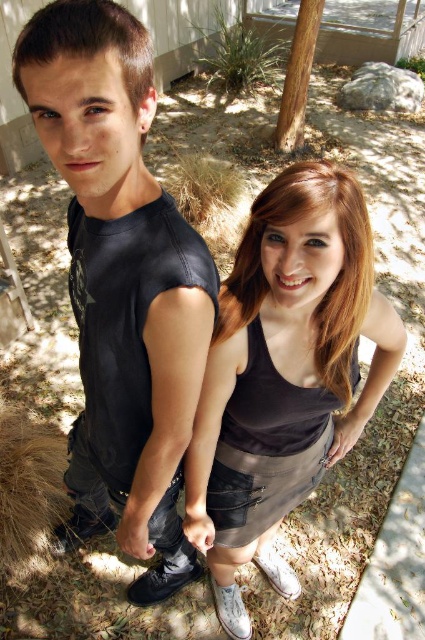
Identify the location of matte black t-shirt at center. (121, 282).

From the picture: Is matte black t-shirt at center positioned before brown rough bark at upper center?

That is True.

Describe the element at coordinates (121, 282) in the screenshot. I see `matte black t-shirt at center` at that location.

Locate an element on the screen. This screenshot has width=425, height=640. matte black t-shirt at center is located at coordinates (121, 282).

Which is more to the right, matte black tank top at center or brown rough bark at upper center?

brown rough bark at upper center

Is point (232, 609) positioned behind point (303, 20)?

No, it is not.

Find the location of a particular element. The image size is (425, 640). matte black tank top at center is located at coordinates (285, 372).

Does matte black t-shirt at center appear on the left side of matte black tank top at center?

Indeed, matte black t-shirt at center is positioned on the left side of matte black tank top at center.

Does matte black t-shirt at center have a greater height compared to matte black tank top at center?

Indeed, matte black t-shirt at center has a greater height compared to matte black tank top at center.

Does point (146, 396) come in front of point (312, 355)?

Yes, point (146, 396) is in front of point (312, 355).

You are a GUI agent. You are given a task and a screenshot of the screen. Output one action in this format:
    pyautogui.click(x=<x>, y=<y>)
    Task: Click on the matte black t-shirt at center
    
    Given the screenshot: What is the action you would take?
    pos(121,282)